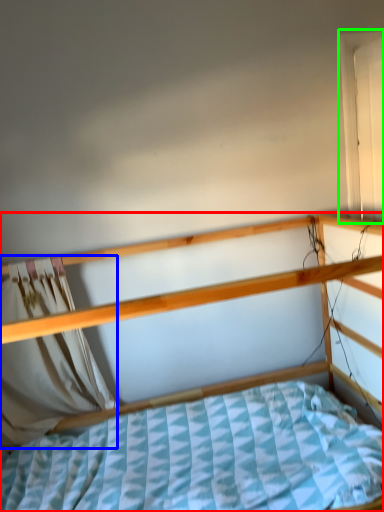
Question: Based on their relative distances, which object is farther from bed (highlighted by a red box)? Choose from curtain (highlighted by a blue box) and window (highlighted by a green box).

Choices:
 (A) curtain
 (B) window

Answer: (B)